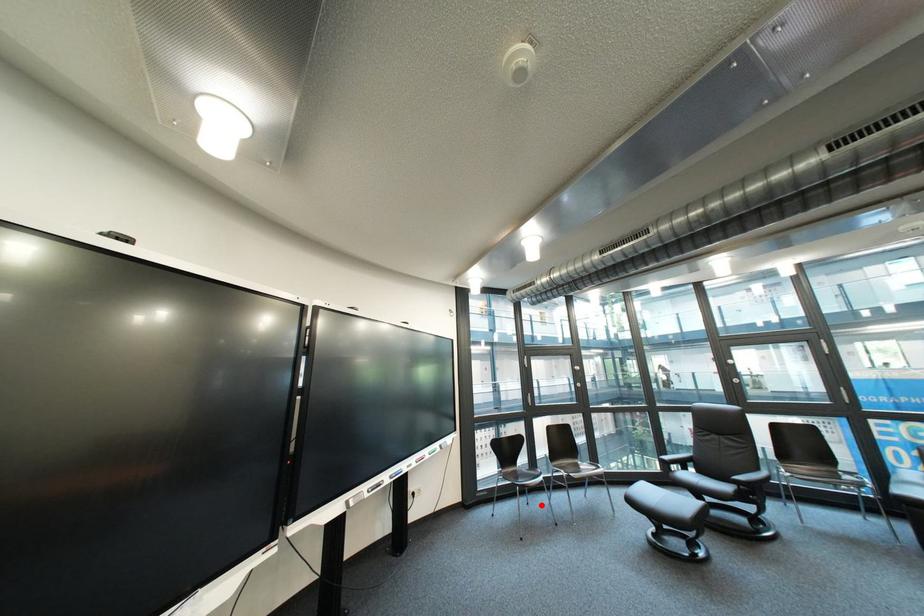
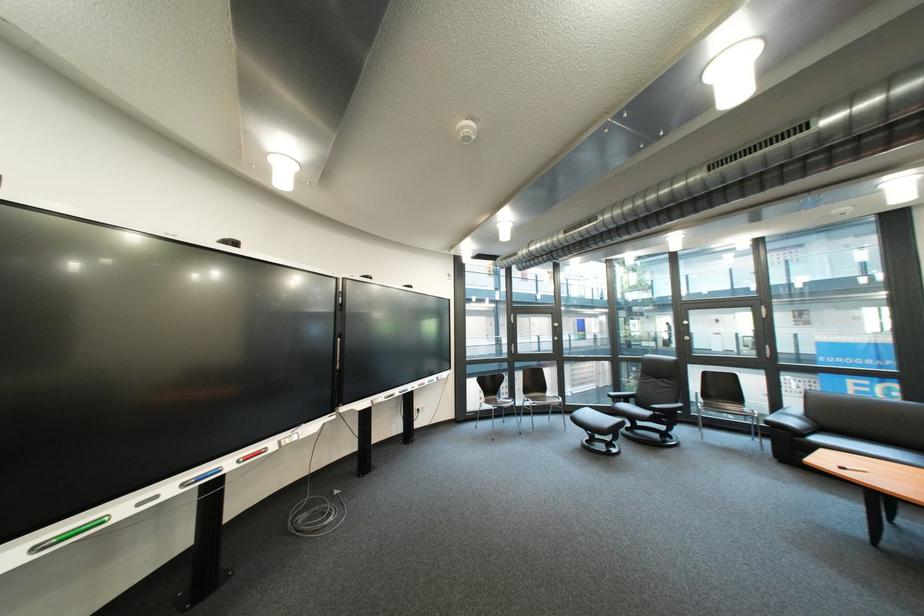
Question: I am providing you with two images of the same scene from different viewpoints. A red point is shown in image1. For the corresponding object point in image2, is it positioned nearer or farther from the camera?

Choices:
 (A) Nearer
 (B) Farther

Answer: (A)